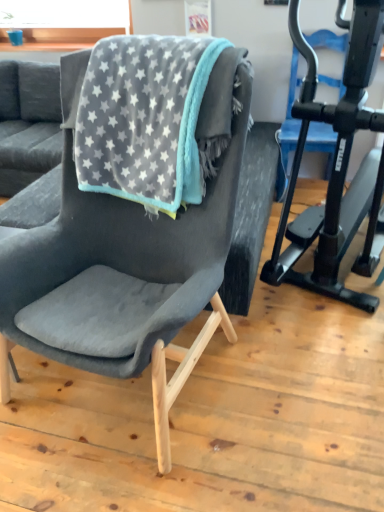
Question: From a real-world perspective, is black matte stationary bicycle at right physically located above or below velvet grey blanket with star pattern at center?

Choices:
 (A) above
 (B) below

Answer: (B)

Question: Is black matte stationary bicycle at right situated inside velvet grey blanket with star pattern at center or outside?

Choices:
 (A) inside
 (B) outside

Answer: (B)

Question: Which object is the closest to the velvet dark gray chair at center?

Choices:
 (A) velvet grey blanket with star pattern at center
 (B) black matte stationary bicycle at right

Answer: (A)

Question: Considering the real-world distances, which object is closest to the velvet dark gray chair at center?

Choices:
 (A) black matte stationary bicycle at right
 (B) velvet grey blanket with star pattern at center

Answer: (B)